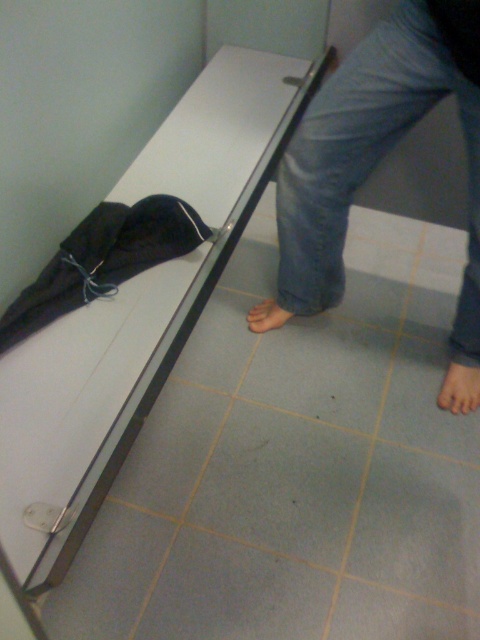
Does pinkish matte skin at lower right have a larger size compared to brown matte foot at lower center?

Actually, pinkish matte skin at lower right might be smaller than brown matte foot at lower center.

Is pinkish matte skin at lower right further to camera compared to brown matte foot at lower center?

No, it is in front of brown matte foot at lower center.

Does point (470, 387) come behind point (264, 300)?

No.

Locate an element on the screen. The height and width of the screenshot is (640, 480). pinkish matte skin at lower right is located at coordinates (459, 388).

Does denim pants at lower right appear on the left side of pinkish matte skin at lower right?

Yes, denim pants at lower right is to the left of pinkish matte skin at lower right.

Can you confirm if denim pants at lower right is positioned above pinkish matte skin at lower right?

Correct, denim pants at lower right is located above pinkish matte skin at lower right.

Does point (317, 284) come in front of point (466, 387)?

Yes.

Identify the location of denim pants at lower right. pos(376,150).

Which is above, denim pants at lower right or brown matte foot at lower center?

Answer: denim pants at lower right is higher up.

At what (x,y) coordinates should I click in order to perform the action: click on denim pants at lower right. Please return your answer as a coordinate pair (x, y). The image size is (480, 640). Looking at the image, I should click on pos(376,150).

I want to click on denim pants at lower right, so click(376, 150).

The height and width of the screenshot is (640, 480). I want to click on denim pants at lower right, so point(376,150).